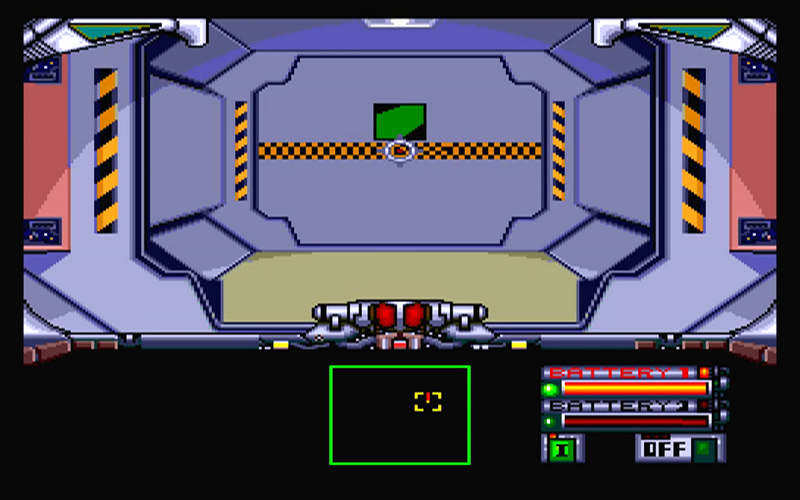
Where is `white light in top center edge`? white light in top center edge is located at coordinates (410, 28).